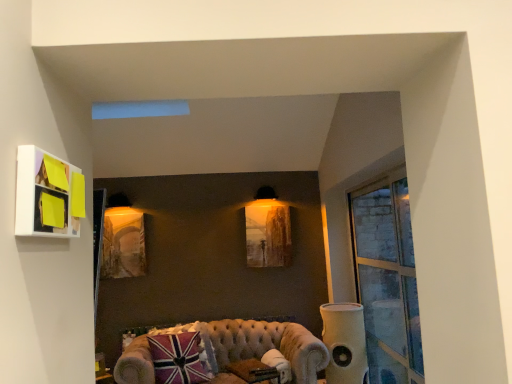
Question: Is matte white picture frame at upper left, which ranks as the 2th picture frame in left-to-right order, in front of or behind velvet beige couch at lower center in the image?

Choices:
 (A) behind
 (B) front

Answer: (B)

Question: From a real-world perspective, is matte white picture frame at upper left, acting as the first picture frame starting from the front, positioned above or below velvet beige couch at lower center?

Choices:
 (A) below
 (B) above

Answer: (B)

Question: Which of these objects is positioned farthest from the clear glass window at right?

Choices:
 (A) white fabric speaker at right
 (B) union jack fabric pillow at lower left
 (C) matte gold picture frame at center, the 2th picture frame when ordered from back to front
 (D) matte white picture frame at upper left, the second picture frame in the right-to-left sequence
 (E) matte wooden picture frame at center, which is counted as the 3th picture frame, starting from the front

Answer: (D)

Question: Which object is positioned closest to the union jack fabric pillow at lower left?

Choices:
 (A) white fabric speaker at right
 (B) matte wooden picture frame at center, the first picture frame positioned from the back
 (C) clear glass window at right
 (D) velvet beige couch at lower center
 (E) matte gold picture frame at center, the 2th picture frame viewed from the front

Answer: (D)